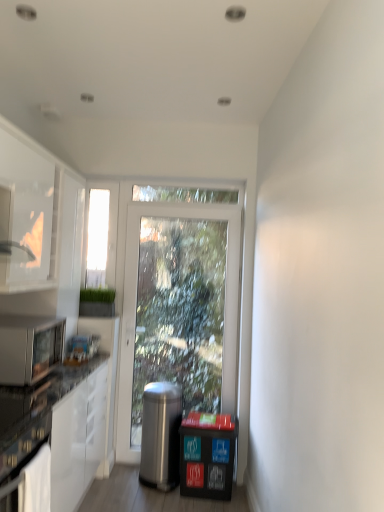
Question: Is the depth of polished stainless steel trash can at center greater than that of satin black microwave oven at lower left?

Choices:
 (A) yes
 (B) no

Answer: (A)

Question: Can you confirm if polished stainless steel trash can at center is shorter than satin black microwave oven at lower left?

Choices:
 (A) yes
 (B) no

Answer: (B)

Question: Can you confirm if polished stainless steel trash can at center is thinner than satin black microwave oven at lower left?

Choices:
 (A) yes
 (B) no

Answer: (A)

Question: Considering the relative sizes of polished stainless steel trash can at center and satin black microwave oven at lower left in the image provided, is polished stainless steel trash can at center taller than satin black microwave oven at lower left?

Choices:
 (A) yes
 (B) no

Answer: (A)

Question: Is polished stainless steel trash can at center smaller than satin black microwave oven at lower left?

Choices:
 (A) yes
 (B) no

Answer: (B)

Question: From the image's perspective, is polished stainless steel trash can at center located beneath satin black microwave oven at lower left?

Choices:
 (A) no
 (B) yes

Answer: (B)

Question: From the image's perspective, is black plastic recycling bin at lower right on satin black microwave oven at lower left?

Choices:
 (A) no
 (B) yes

Answer: (A)

Question: From the image's perspective, is black plastic recycling bin at lower right beneath satin black microwave oven at lower left?

Choices:
 (A) no
 (B) yes

Answer: (B)

Question: Considering the relative sizes of black plastic recycling bin at lower right and satin black microwave oven at lower left in the image provided, is black plastic recycling bin at lower right bigger than satin black microwave oven at lower left?

Choices:
 (A) no
 (B) yes

Answer: (B)

Question: Can you confirm if black plastic recycling bin at lower right is positioned to the right of satin black microwave oven at lower left?

Choices:
 (A) yes
 (B) no

Answer: (A)

Question: Is satin black microwave oven at lower left at the back of black plastic recycling bin at lower right?

Choices:
 (A) no
 (B) yes

Answer: (A)

Question: Is the position of black plastic recycling bin at lower right less distant than that of satin black microwave oven at lower left?

Choices:
 (A) yes
 (B) no

Answer: (B)

Question: Does white glossy cabinet at left lie in front of satin black microwave oven at lower left?

Choices:
 (A) yes
 (B) no

Answer: (B)